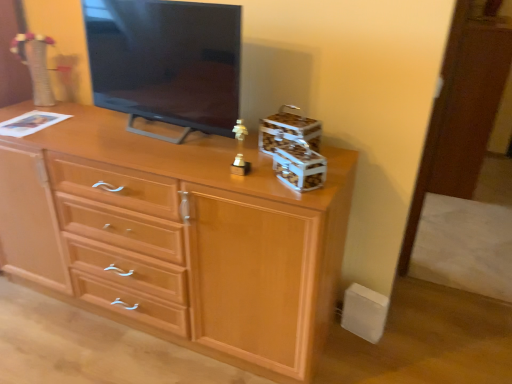
Where is `free space in front of matte black tv at center`? free space in front of matte black tv at center is located at coordinates (178, 163).